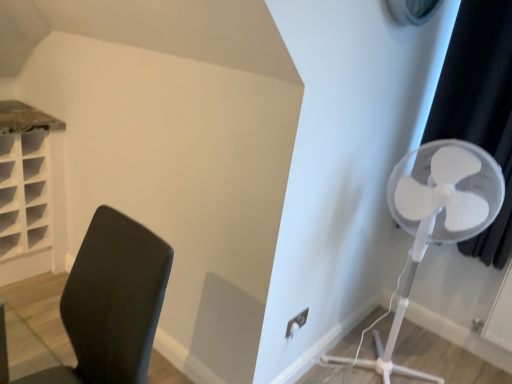
In order to click on black plastic chair at left in this screenshot , I will do tap(112, 303).

What is the approximate width of black fabric curtain at right?

black fabric curtain at right is 8.90 inches in width.

Locate an element on the screen. This screenshot has width=512, height=384. white plastic fan at right is located at coordinates (438, 214).

Where is `black plastic chair at left`? The width and height of the screenshot is (512, 384). black plastic chair at left is located at coordinates (112, 303).

Which object is closer to the camera, black plastic chair at left or black fabric curtain at right?

Positioned in front is black plastic chair at left.

Is black plastic chair at left touching black fabric curtain at right?

No, black plastic chair at left is not in contact with black fabric curtain at right.

Who is bigger, black plastic chair at left or black fabric curtain at right?

With larger size is black plastic chair at left.

Where is `furniture beneath the black fabric curtain at right (from a real-world perspective)`? The image size is (512, 384). furniture beneath the black fabric curtain at right (from a real-world perspective) is located at coordinates (112, 303).

From the image's perspective, relative to black plastic chair at left, is black fabric curtain at right above or below?

Based on their image positions, black fabric curtain at right is located above black plastic chair at left.

Could you tell me if black fabric curtain at right is facing black plastic chair at left?

Yes, black fabric curtain at right faces towards black plastic chair at left.

From a real-world perspective, which is physically below, black fabric curtain at right or black plastic chair at left?

black plastic chair at left.

This screenshot has width=512, height=384. In order to click on furniture in front of the black fabric curtain at right in this screenshot , I will do `click(112, 303)`.

Is black plastic chair at left next to white plastic fan at right?

No, black plastic chair at left is not next to white plastic fan at right.

Is black plastic chair at left outside of white plastic fan at right?

Yes, black plastic chair at left is located beyond the bounds of white plastic fan at right.

Is black plastic chair at left aimed at white plastic fan at right?

No, black plastic chair at left is not turned towards white plastic fan at right.

You are a GUI agent. You are given a task and a screenshot of the screen. Output one action in this format:
    pyautogui.click(x=<x>, y=<y>)
    Task: Click on the mechanical fan that is on the right side of black plastic chair at left
    This screenshot has height=384, width=512.
    Given the screenshot: What is the action you would take?
    pyautogui.click(x=438, y=214)

Is white plastic fan at right next to black plastic chair at left and touching it?

No, white plastic fan at right is not beside black plastic chair at left.

Relative to black plastic chair at left, is white plastic fan at right in front or behind?

Clearly, white plastic fan at right is behind black plastic chair at left.

Which of these two, white plastic fan at right or black plastic chair at left, is bigger?

Bigger between the two is white plastic fan at right.

From the image's perspective, which one is positioned higher, black fabric curtain at right or white plastic fan at right?

black fabric curtain at right, from the image's perspective.

Does black fabric curtain at right have a smaller size compared to white plastic fan at right?

Yes.

Would you say white plastic fan at right is part of black fabric curtain at right's contents?

No, black fabric curtain at right does not contain white plastic fan at right.

Which is nearer, (487, 141) or (470, 205)?

The point (470, 205) is closer to the camera.

Does white plastic fan at right appear on the right side of black fabric curtain at right?

Incorrect, white plastic fan at right is not on the right side of black fabric curtain at right.

In the image, there is a black fabric curtain at right. Find the location of `mechanical fan below it (from a real-world perspective)`. mechanical fan below it (from a real-world perspective) is located at coordinates (438, 214).

Which of these two, white plastic fan at right or black fabric curtain at right, is bigger?

Bigger between the two is white plastic fan at right.

Between point (498, 206) and point (469, 62), which one is positioned in front?

The point (498, 206) is closer to the camera.

Locate an element on the screen. Image resolution: width=512 pixels, height=384 pixels. curtain to the right of black plastic chair at left is located at coordinates (480, 107).

The height and width of the screenshot is (384, 512). Identify the location of curtain above the black plastic chair at left (from the image's perspective). (480, 107).

Consider the image. Estimate the real-world distances between objects in this image. Which object is closer to black fabric curtain at right, black plastic chair at left or white plastic fan at right?

white plastic fan at right.

From the image, which object appears to be farther from white plastic fan at right, black fabric curtain at right or black plastic chair at left?

Among the two, black plastic chair at left is located further to white plastic fan at right.

From the image, which object appears to be farther from white plastic fan at right, black plastic chair at left or black fabric curtain at right?

black plastic chair at left is positioned further to the anchor white plastic fan at right.

Estimate the real-world distances between objects in this image. Which object is further from black plastic chair at left, black fabric curtain at right or white plastic fan at right?

Among the two, black fabric curtain at right is located further to black plastic chair at left.

Which object lies nearer to the anchor point black plastic chair at left, white plastic fan at right or black fabric curtain at right?

Based on the image, white plastic fan at right appears to be nearer to black plastic chair at left.

From the image, which object appears to be nearer to black fabric curtain at right, white plastic fan at right or black plastic chair at left?

Among the two, white plastic fan at right is located nearer to black fabric curtain at right.

In order to click on mechanical fan located between black plastic chair at left and black fabric curtain at right in the left-right direction in this screenshot , I will do `click(438, 214)`.